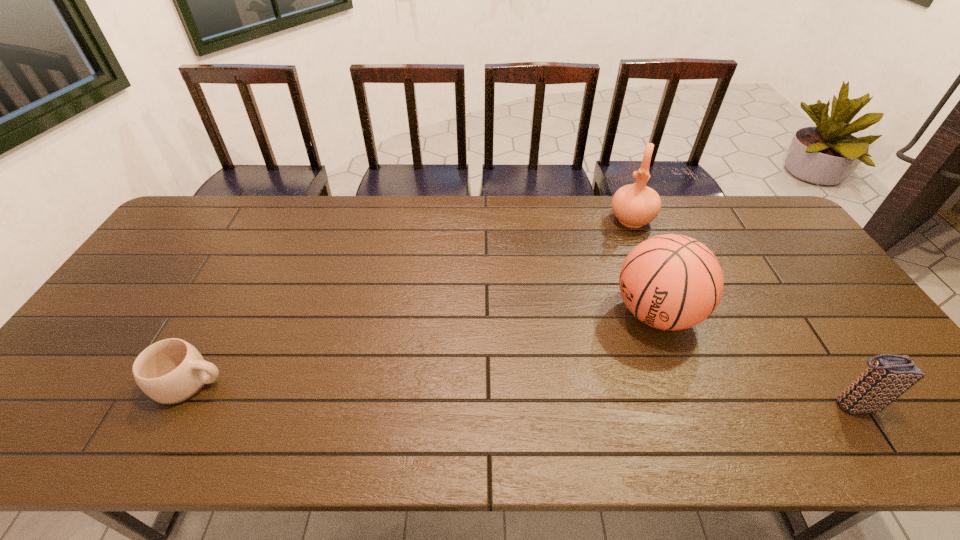
This screenshot has width=960, height=540. I want to click on unoccupied area between the farthest object and the leftmost object, so click(x=411, y=301).

This screenshot has height=540, width=960. Find the location of `vacant space that's between the third nearest object and the mug`. vacant space that's between the third nearest object and the mug is located at coordinates (423, 348).

You are a GUI agent. You are given a task and a screenshot of the screen. Output one action in this format:
    pyautogui.click(x=<x>, y=<y>)
    Task: Click on the vacant area that lies between the mug and the pottery
    
    Given the screenshot: What is the action you would take?
    pyautogui.click(x=411, y=301)

Identify which object is the second nearest to the shortest object. Please provide its 2D coordinates. Your answer should be formatted as a tuple, i.e. [(x, y)], where the tuple contains the x and y coordinates of a point satisfying the conditions above.

[(635, 205)]

Choose which object is the second nearest neighbor to the clutch bag. Please provide its 2D coordinates. Your answer should be formatted as a tuple, i.e. [(x, y)], where the tuple contains the x and y coordinates of a point satisfying the conditions above.

[(635, 205)]

This screenshot has height=540, width=960. In order to click on vacant region that satisfies the following two spatial constraints: 1. on the front side of the farthest object; 2. with the zip open on the second shortest object in this screenshot , I will do `click(704, 404)`.

Find the location of a particular element. This screenshot has width=960, height=540. free space that satisfies the following two spatial constraints: 1. on the front side of the third tallest object; 2. with the zip open on the pottery is located at coordinates [704, 404].